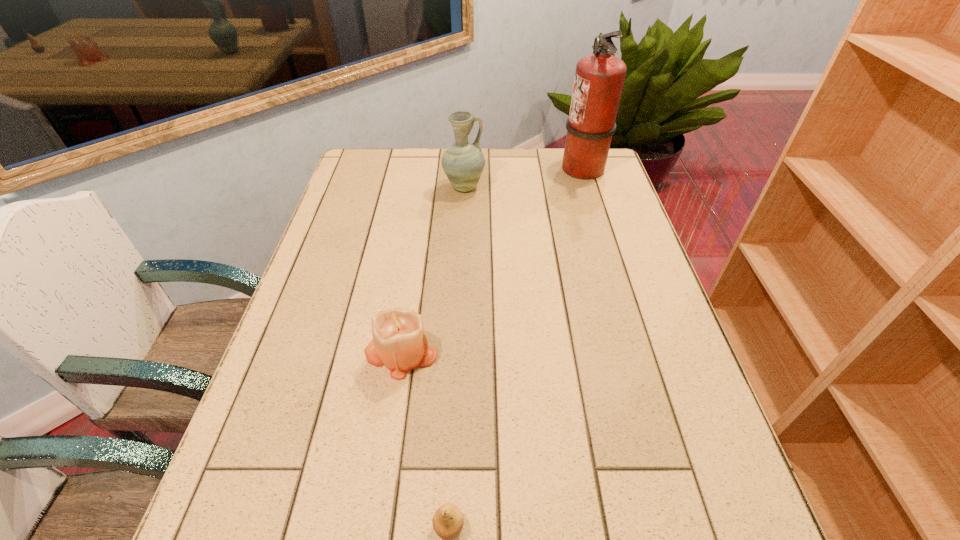
Identify the location of fire extinguisher that is at the far edge. This screenshot has height=540, width=960. (599, 78).

Identify the location of pitcher that is at the far edge. (463, 162).

Locate an element on the screen. The width and height of the screenshot is (960, 540). object that is at the right edge is located at coordinates (599, 78).

Find the location of a particular element. This screenshot has width=960, height=540. object that is at the far right corner is located at coordinates [599, 78].

Where is `free location at the far edge of the desktop`? This screenshot has height=540, width=960. free location at the far edge of the desktop is located at coordinates (540, 156).

In the image, there is a desktop. Where is `vacant area at the left edge`? The image size is (960, 540). vacant area at the left edge is located at coordinates (345, 273).

Find the location of a particular element. This screenshot has width=960, height=540. free space at the right edge of the desktop is located at coordinates pos(620,386).

The width and height of the screenshot is (960, 540). In the image, there is a desktop. In order to click on vacant space at the near right corner in this screenshot , I will do `click(718, 539)`.

This screenshot has height=540, width=960. Find the location of `vacant space in between the fire extinguisher and the third tallest object`. vacant space in between the fire extinguisher and the third tallest object is located at coordinates (492, 260).

Locate an element on the screen. Image resolution: width=960 pixels, height=540 pixels. free space between the fire extinguisher and the second tallest object is located at coordinates (523, 178).